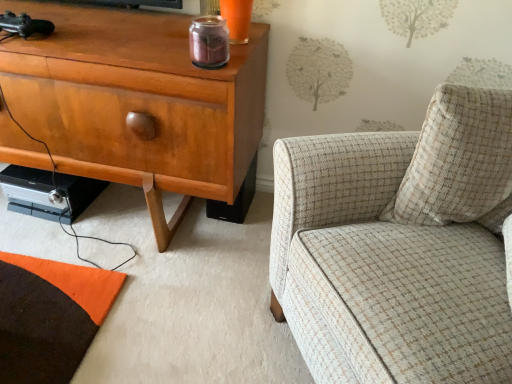
Locate an element on the screen. The width and height of the screenshot is (512, 384). plaid fabric armchair at right is located at coordinates (399, 246).

Measure the distance between matte wood cabinet at left and camera.

They are 3.46 feet apart.

The width and height of the screenshot is (512, 384). What do you see at coordinates (138, 103) in the screenshot?
I see `matte wood cabinet at left` at bounding box center [138, 103].

Locate an element on the screen. beige textured pillow at right is located at coordinates (459, 162).

Where is `plaid fabric armchair at right`? plaid fabric armchair at right is located at coordinates pos(399,246).

From a real-world perspective, is matte wood cabinet at left over plaid fabric armchair at right?

Incorrect, from a real-world perspective, matte wood cabinet at left is lower than plaid fabric armchair at right.

Can you tell me how much matte wood cabinet at left and plaid fabric armchair at right differ in facing direction?

58.8 degrees separate the facing orientations of matte wood cabinet at left and plaid fabric armchair at right.

Is the depth of matte wood cabinet at left less than that of plaid fabric armchair at right?

No, it is behind plaid fabric armchair at right.

Between matte wood cabinet at left and plaid fabric armchair at right, which one has smaller width?

Thinner between the two is matte wood cabinet at left.

Are matte wood cabinet at left and beige textured pillow at right beside each other?

They are not placed beside each other.

Is matte wood cabinet at left spatially inside beige textured pillow at right, or outside of it?

matte wood cabinet at left is not inside beige textured pillow at right, it's outside.

Measure the distance between matte wood cabinet at left and beige textured pillow at right.

The distance of matte wood cabinet at left from beige textured pillow at right is 27.17 inches.

From the image's perspective, is matte wood cabinet at left under beige textured pillow at right?

No, from the image's perspective, matte wood cabinet at left is not beneath beige textured pillow at right.

Are beige textured pillow at right and plaid fabric armchair at right located far from each other?

No, beige textured pillow at right is in close proximity to plaid fabric armchair at right.

Would you say beige textured pillow at right is to the left or to the right of plaid fabric armchair at right in the picture?

beige textured pillow at right is positioned on plaid fabric armchair at right's left side.

In terms of size, does beige textured pillow at right appear bigger or smaller than plaid fabric armchair at right?

Clearly, beige textured pillow at right is smaller in size than plaid fabric armchair at right.

Between beige textured pillow at right and plaid fabric armchair at right, which one is positioned in front?

Positioned in front is plaid fabric armchair at right.

Could you tell me if beige textured pillow at right is turned towards matte wood cabinet at left?

No.

Is beige textured pillow at right to the left of matte wood cabinet at left from the viewer's perspective?

No, beige textured pillow at right is not to the left of matte wood cabinet at left.

From the image's perspective, does beige textured pillow at right appear higher than matte wood cabinet at left?

No, from the image's perspective, beige textured pillow at right is not on top of matte wood cabinet at left.

Locate an element on the screen. The width and height of the screenshot is (512, 384). cabinetry behind the beige textured pillow at right is located at coordinates (138, 103).

Find the location of a particular element. pillow above the plaid fabric armchair at right (from the image's perspective) is located at coordinates (459, 162).

Considering the sizes of objects plaid fabric armchair at right and beige textured pillow at right in the image provided, who is thinner, plaid fabric armchair at right or beige textured pillow at right?

beige textured pillow at right is thinner.

Is plaid fabric armchair at right oriented away from beige textured pillow at right?

Yes.

From the image's perspective, is plaid fabric armchair at right on beige textured pillow at right?

A: No, from the image's perspective, plaid fabric armchair at right is not on top of beige textured pillow at right.

From the image's perspective, is plaid fabric armchair at right positioned above or below matte wood cabinet at left?

Based on their image positions, plaid fabric armchair at right is located beneath matte wood cabinet at left.

Is plaid fabric armchair at right not close to matte wood cabinet at left?

Actually, plaid fabric armchair at right and matte wood cabinet at left are a little close together.

Is matte wood cabinet at left inside plaid fabric armchair at right?

No, matte wood cabinet at left is not surrounded by plaid fabric armchair at right.

Between plaid fabric armchair at right and matte wood cabinet at left, which one has larger size?

plaid fabric armchair at right is bigger.

I want to click on chair in front of the matte wood cabinet at left, so click(399, 246).

The image size is (512, 384). I want to click on cabinetry below the beige textured pillow at right (from a real-world perspective), so click(138, 103).

When comparing their distances from plaid fabric armchair at right, does beige textured pillow at right or matte wood cabinet at left seem closer?

Among the two, beige textured pillow at right is located nearer to plaid fabric armchair at right.

Estimate the real-world distances between objects in this image. Which object is further from beige textured pillow at right, matte wood cabinet at left or plaid fabric armchair at right?

matte wood cabinet at left is positioned further to the anchor beige textured pillow at right.

Which object lies further to the anchor point beige textured pillow at right, plaid fabric armchair at right or matte wood cabinet at left?

matte wood cabinet at left is positioned further to the anchor beige textured pillow at right.

In the scene shown: Based on their spatial positions, is matte wood cabinet at left or beige textured pillow at right further from plaid fabric armchair at right?

Based on the image, matte wood cabinet at left appears to be further to plaid fabric armchair at right.

Which object lies nearer to the anchor point matte wood cabinet at left, plaid fabric armchair at right or beige textured pillow at right?

plaid fabric armchair at right is positioned closer to the anchor matte wood cabinet at left.

Looking at the image, which one is located closer to matte wood cabinet at left, beige textured pillow at right or plaid fabric armchair at right?

plaid fabric armchair at right.

The image size is (512, 384). I want to click on pillow situated between matte wood cabinet at left and plaid fabric armchair at right from left to right, so click(x=459, y=162).